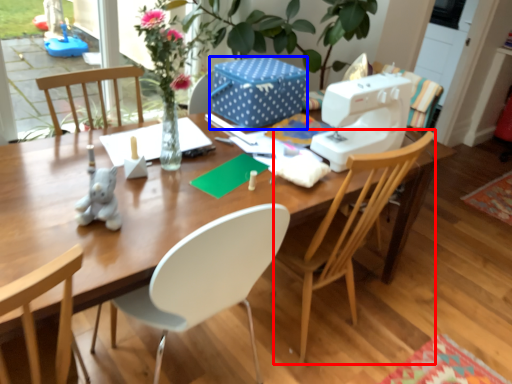
Question: Which of the following is the farthest to the observer, chair (highlighted by a red box) or box (highlighted by a blue box)?

Choices:
 (A) chair
 (B) box

Answer: (B)